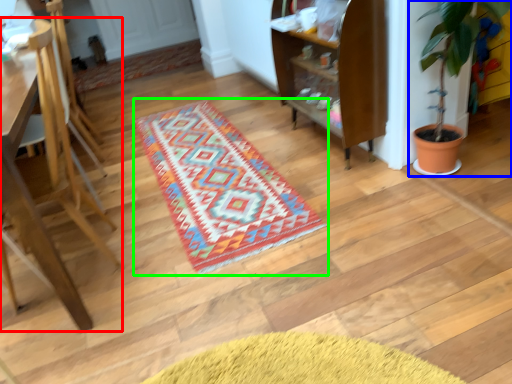
Question: Estimate the real-world distances between objects in this image. Which object is farther from furniture (highlighted by a red box), houseplant (highlighted by a blue box) or mat (highlighted by a green box)?

Choices:
 (A) houseplant
 (B) mat

Answer: (A)